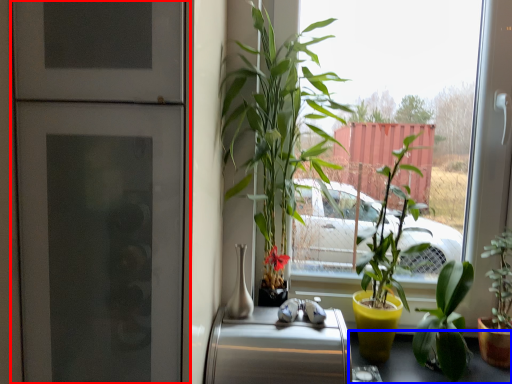
Question: Which object is further to the camera taking this photo, fridge (highlighted by a red box) or table (highlighted by a blue box)?

Choices:
 (A) fridge
 (B) table

Answer: (B)